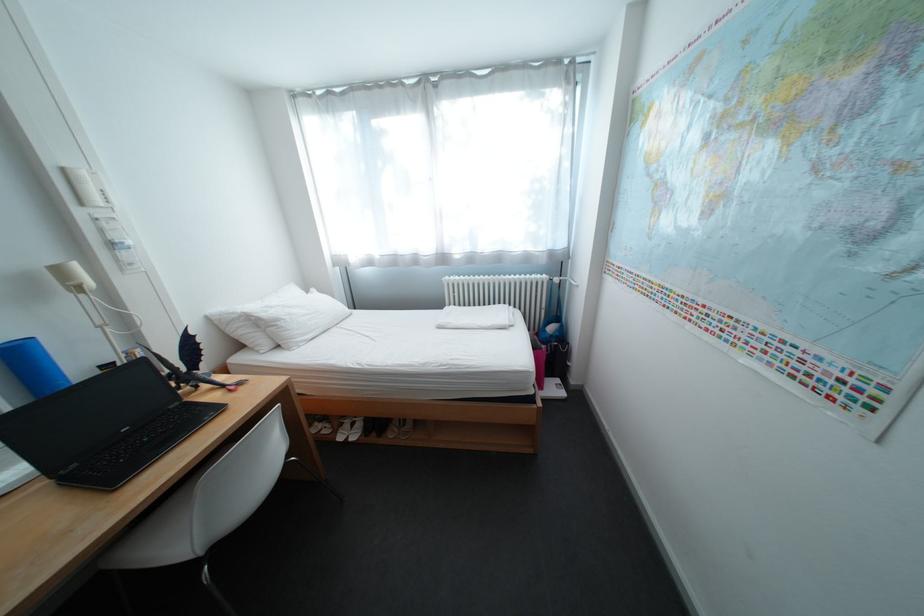
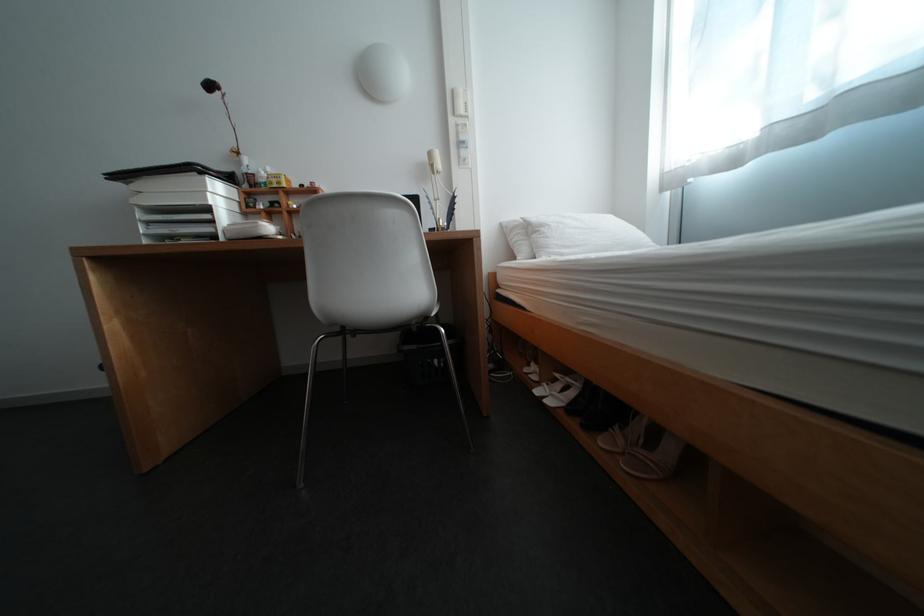
Find the pixel in the second image that matches point (292, 322) in the first image.

(555, 228)